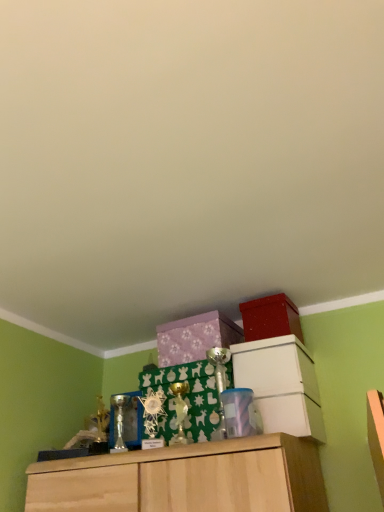
The image size is (384, 512). Describe the element at coordinates (270, 318) in the screenshot. I see `matte red storage box at upper right` at that location.

Describe the element at coordinates (195, 337) in the screenshot. I see `purple matte box at center, positioned as the second cabinetry in right-to-left order` at that location.

This screenshot has width=384, height=512. Find the location of `matte red storage box at upper right`. matte red storage box at upper right is located at coordinates (270, 318).

Is purple matte box at center, positioned as the second cabinetry in right-to-left order, in front of or behind white matte cabinet at upper center, the 2th cabinetry viewed from the left, in the image?

Visually, purple matte box at center, positioned as the second cabinetry in right-to-left order, is located behind white matte cabinet at upper center, the 2th cabinetry viewed from the left.

Considering the points (218, 330) and (238, 365), which point is in front, point (218, 330) or point (238, 365)?

The point (238, 365) is in front.

Considering the sizes of purple matte box at center, positioned as the second cabinetry in right-to-left order, and white matte cabinet at upper center, the 2th cabinetry viewed from the left, in the image, is purple matte box at center, positioned as the second cabinetry in right-to-left order, taller or shorter than white matte cabinet at upper center, the 2th cabinetry viewed from the left,?

Considering their sizes, purple matte box at center, positioned as the second cabinetry in right-to-left order, has less height than white matte cabinet at upper center, the 2th cabinetry viewed from the left.

Can you confirm if white matte cabinet at upper center, the first cabinetry in the right-to-left sequence, is positioned to the right of purple matte box at center, positioned as the second cabinetry in right-to-left order?

Yes.

From a real-world perspective, is white matte cabinet at upper center, the 2th cabinetry viewed from the left, under purple matte box at center, positioned as the second cabinetry in right-to-left order?

Yes, from a real-world perspective, white matte cabinet at upper center, the 2th cabinetry viewed from the left, is beneath purple matte box at center, positioned as the second cabinetry in right-to-left order.

Is point (294, 428) positioned before point (167, 358)?

Yes, it is.

Can you confirm if white matte cabinet at upper center, the 2th cabinetry viewed from the left, is shorter than purple matte box at center, the 1th cabinetry in the left-to-right sequence?

In fact, white matte cabinet at upper center, the 2th cabinetry viewed from the left, may be taller than purple matte box at center, the 1th cabinetry in the left-to-right sequence.

Is white matte cabinet at upper center, the 2th cabinetry viewed from the left, positioned with its back to translucent plastic container at center?

No, translucent plastic container at center is not at the back of white matte cabinet at upper center, the 2th cabinetry viewed from the left.

Based on the photo, considering the relative sizes of white matte cabinet at upper center, the first cabinetry in the right-to-left sequence, and translucent plastic container at center in the image provided, is white matte cabinet at upper center, the first cabinetry in the right-to-left sequence, thinner than translucent plastic container at center?

In fact, white matte cabinet at upper center, the first cabinetry in the right-to-left sequence, might be wider than translucent plastic container at center.

Considering the positions of objects white matte cabinet at upper center, the 2th cabinetry viewed from the left, and translucent plastic container at center in the image provided, who is more to the left, white matte cabinet at upper center, the 2th cabinetry viewed from the left, or translucent plastic container at center?

From the viewer's perspective, white matte cabinet at upper center, the 2th cabinetry viewed from the left, appears more on the left side.

Where is `the 2nd cabinetry to the left of the matte red storage box at upper right, starting your count from the anchor`? This screenshot has height=512, width=384. the 2nd cabinetry to the left of the matte red storage box at upper right, starting your count from the anchor is located at coordinates (195, 337).

What's the angular difference between matte red storage box at upper right and purple matte box at center, the 1th cabinetry in the left-to-right sequence,'s facing directions?

They differ by 0.000296 degrees in their facing directions.

Is the depth of matte red storage box at upper right greater than that of purple matte box at center, positioned as the second cabinetry in right-to-left order?

No, the depth of matte red storage box at upper right is less than that of purple matte box at center, positioned as the second cabinetry in right-to-left order.

From the image's perspective, is matte red storage box at upper right on purple matte box at center, positioned as the second cabinetry in right-to-left order?

Yes, from the image's perspective, matte red storage box at upper right is over purple matte box at center, positioned as the second cabinetry in right-to-left order.

Considering the relative sizes of purple matte box at center, positioned as the second cabinetry in right-to-left order, and matte red storage box at upper right in the image provided, is purple matte box at center, positioned as the second cabinetry in right-to-left order, smaller than matte red storage box at upper right?

No, purple matte box at center, positioned as the second cabinetry in right-to-left order, is not smaller than matte red storage box at upper right.

Between purple matte box at center, positioned as the second cabinetry in right-to-left order, and matte red storage box at upper right, which one has larger width?

purple matte box at center, positioned as the second cabinetry in right-to-left order.

Considering the relative sizes of purple matte box at center, positioned as the second cabinetry in right-to-left order, and matte red storage box at upper right in the image provided, is purple matte box at center, positioned as the second cabinetry in right-to-left order, taller than matte red storage box at upper right?

Incorrect, the height of purple matte box at center, positioned as the second cabinetry in right-to-left order, is not larger of that of matte red storage box at upper right.

From a real-world perspective, is purple matte box at center, the 1th cabinetry in the left-to-right sequence, positioned under matte red storage box at upper right based on gravity?

Yes, from a real-world perspective, purple matte box at center, the 1th cabinetry in the left-to-right sequence, is beneath matte red storage box at upper right.

Which object is thinner, translucent plastic container at center or matte red storage box at upper right?

matte red storage box at upper right is thinner.

Is translucent plastic container at center in front of or behind matte red storage box at upper right in the image?

translucent plastic container at center is in front of matte red storage box at upper right.

Would you say translucent plastic container at center contains matte red storage box at upper right?

No, matte red storage box at upper right is not inside translucent plastic container at center.

From a real-world perspective, who is located lower, translucent plastic container at center or matte red storage box at upper right?

translucent plastic container at center.

Between translucent plastic container at center and white matte cabinet at upper center, the first cabinetry in the right-to-left sequence, which one has larger width?

white matte cabinet at upper center, the first cabinetry in the right-to-left sequence.

Considering the relative positions of translucent plastic container at center and white matte cabinet at upper center, the 2th cabinetry viewed from the left, in the image provided, is translucent plastic container at center to the right of white matte cabinet at upper center, the 2th cabinetry viewed from the left, from the viewer's perspective?

Yes.

Would you say translucent plastic container at center is outside white matte cabinet at upper center, the 2th cabinetry viewed from the left?

Yes, translucent plastic container at center is not within white matte cabinet at upper center, the 2th cabinetry viewed from the left.

Does translucent plastic container at center turn towards white matte cabinet at upper center, the 2th cabinetry viewed from the left?

No, translucent plastic container at center is not facing towards white matte cabinet at upper center, the 2th cabinetry viewed from the left.

Locate an element on the screen. The height and width of the screenshot is (512, 384). cabinetry located above the white matte cabinet at upper center, the first cabinetry in the right-to-left sequence (from the image's perspective) is located at coordinates (195, 337).

At what (x,y) coordinates should I click in order to perform the action: click on cabinetry in front of the purple matte box at center, the 1th cabinetry in the left-to-right sequence. Please return your answer as a coordinate pair (x, y). Looking at the image, I should click on (281, 385).

When comparing their distances from purple matte box at center, positioned as the second cabinetry in right-to-left order, does white matte cabinet at upper center, the 2th cabinetry viewed from the left, or matte red storage box at upper right seem further?

white matte cabinet at upper center, the 2th cabinetry viewed from the left.

Estimate the real-world distances between objects in this image. Which object is closer to purple matte box at center, positioned as the second cabinetry in right-to-left order, matte red storage box at upper right or translucent plastic container at center?

matte red storage box at upper right lies closer to purple matte box at center, positioned as the second cabinetry in right-to-left order, than the other object.

Which object lies nearer to the anchor point translucent plastic container at center, white matte cabinet at upper center, the 2th cabinetry viewed from the left, or purple matte box at center, positioned as the second cabinetry in right-to-left order?

Among the two, white matte cabinet at upper center, the 2th cabinetry viewed from the left, is located nearer to translucent plastic container at center.

Considering their positions, is white matte cabinet at upper center, the 2th cabinetry viewed from the left, positioned further to matte red storage box at upper right than translucent plastic container at center?

Based on the image, translucent plastic container at center appears to be further to matte red storage box at upper right.

Estimate the real-world distances between objects in this image. Which object is further from matte red storage box at upper right, purple matte box at center, positioned as the second cabinetry in right-to-left order, or translucent plastic container at center?

Among the two, translucent plastic container at center is located further to matte red storage box at upper right.

Looking at the image, which one is located closer to purple matte box at center, the 1th cabinetry in the left-to-right sequence, translucent plastic container at center or white matte cabinet at upper center, the first cabinetry in the right-to-left sequence?

white matte cabinet at upper center, the first cabinetry in the right-to-left sequence, is closer to purple matte box at center, the 1th cabinetry in the left-to-right sequence.

In the scene shown: Based on their spatial positions, is matte red storage box at upper right or purple matte box at center, positioned as the second cabinetry in right-to-left order, further from white matte cabinet at upper center, the 2th cabinetry viewed from the left?

Among the two, purple matte box at center, positioned as the second cabinetry in right-to-left order, is located further to white matte cabinet at upper center, the 2th cabinetry viewed from the left.

Based on their spatial positions, is translucent plastic container at center or white matte cabinet at upper center, the 2th cabinetry viewed from the left, further from matte red storage box at upper right?

translucent plastic container at center is positioned further to the anchor matte red storage box at upper right.

Find the location of `cabinetry between purple matte box at center, the 1th cabinetry in the left-to-right sequence, and translucent plastic container at center`. cabinetry between purple matte box at center, the 1th cabinetry in the left-to-right sequence, and translucent plastic container at center is located at coordinates (281, 385).

Locate an element on the screen. cabinetry located between purple matte box at center, the 1th cabinetry in the left-to-right sequence, and matte red storage box at upper right in the left-right direction is located at coordinates [x=281, y=385].

At what (x,y) coordinates should I click in order to perform the action: click on storage box situated between purple matte box at center, positioned as the second cabinetry in right-to-left order, and translucent plastic container at center from left to right. Please return your answer as a coordinate pair (x, y). This screenshot has width=384, height=512. Looking at the image, I should click on (270, 318).